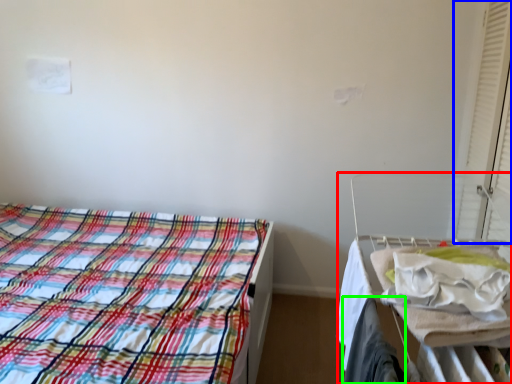
Question: Which object is positioned farthest from hospital bed (highlighted by a red box)? Select from curtain (highlighted by a blue box) and clothing (highlighted by a green box).

Choices:
 (A) curtain
 (B) clothing

Answer: (A)